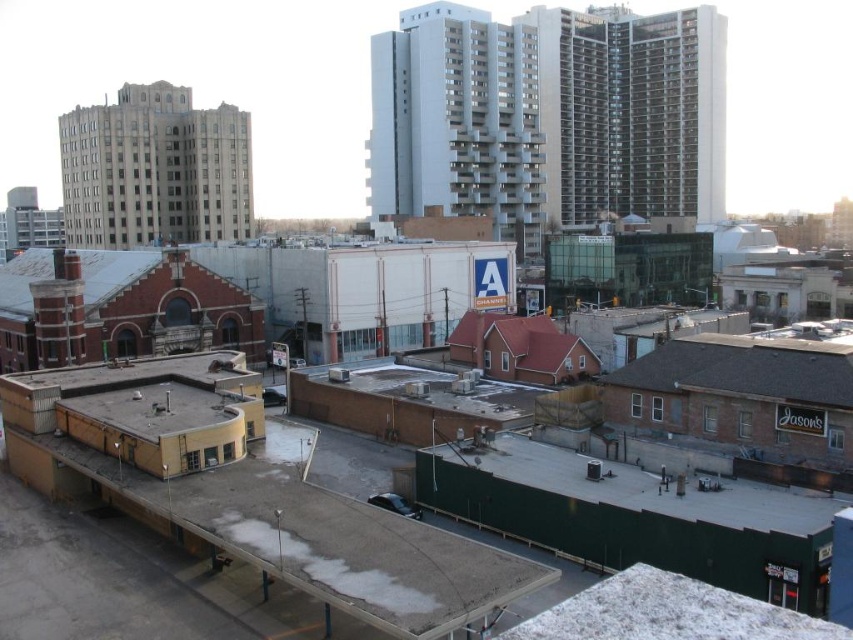
You are standing at the green fence in the foreground of the urban landscape. You notice two points marked in the scene. Point A is at coordinates point (x=570, y=456) and Point B is at coordinates point (x=796, y=387). Which point is closer to you?

Point B at point (x=796, y=387) is closer to you because it is in front of Point A at point (x=570, y=456).

You are a delivery drone flying at an altitude of 25 feet above the ground. Your GPS indicates that you need to land precisely between the green matte wall at lower center and the brown shingles at lower right. Can you safely descend to land within this space without exceeding your operational altitude?

The distance between the green matte wall at lower center and the brown shingles at lower right is 21.92 feet. Since your operational altitude is 25 feet, you can safely descend and land between them as the distance allows for a safe landing within your operational limits.